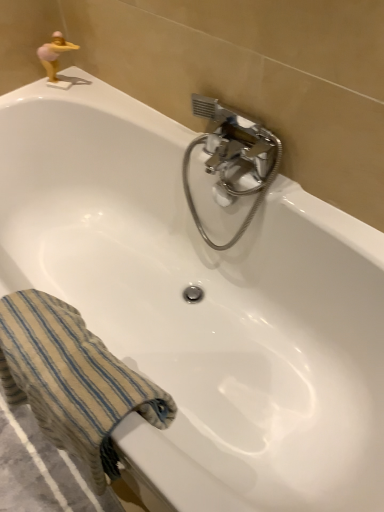
The image size is (384, 512). I want to click on free region on the left part of gold plastic figurine at upper left, so click(x=35, y=92).